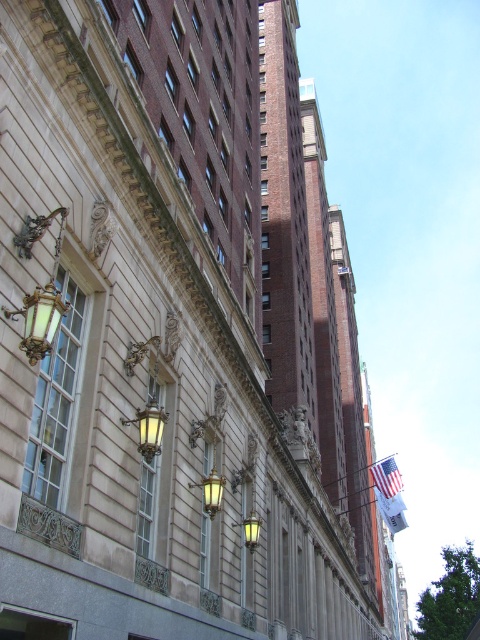
Who is more forward, (210, 513) or (395, 515)?

Point (210, 513) is in front.

Is point (216, 474) behind point (399, 520)?

That is False.

Is point (206, 483) farther from viewer compared to point (399, 506)?

No, it is in front of (399, 506).

Identify the location of matte gold light fixture at lower center. This screenshot has width=480, height=640. (211, 492).

Who is positioned more to the left, matte brass lamp at center or white fabric flag at lower right?

matte brass lamp at center is more to the left.

Does matte brass lamp at center come behind white fabric flag at lower right?

No.

Does point (136, 417) come closer to viewer compared to point (397, 500)?

Yes, point (136, 417) is in front of point (397, 500).

At what (x,y) coordinates should I click in order to perform the action: click on matte brass lamp at center. Please return your answer as a coordinate pair (x, y). The height and width of the screenshot is (640, 480). Looking at the image, I should click on (148, 428).

Between matte glass lamp at left and matte brass lamp at center, which one has more height?

matte glass lamp at left

Is matte glass lamp at left bigger than matte brass lamp at center?

Yes.

Does point (19, 348) come behind point (149, 440)?

No, it is not.

At what (x,y) coordinates should I click in order to perform the action: click on matte glass lamp at left. Please return your answer as a coordinate pair (x, y). Looking at the image, I should click on (39, 321).